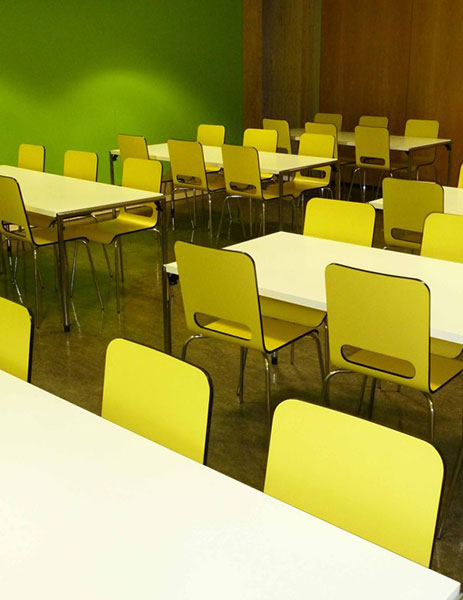
Locate an element on the screen. desks is located at coordinates (64, 446), (318, 257), (455, 199), (416, 139), (278, 162), (55, 192).